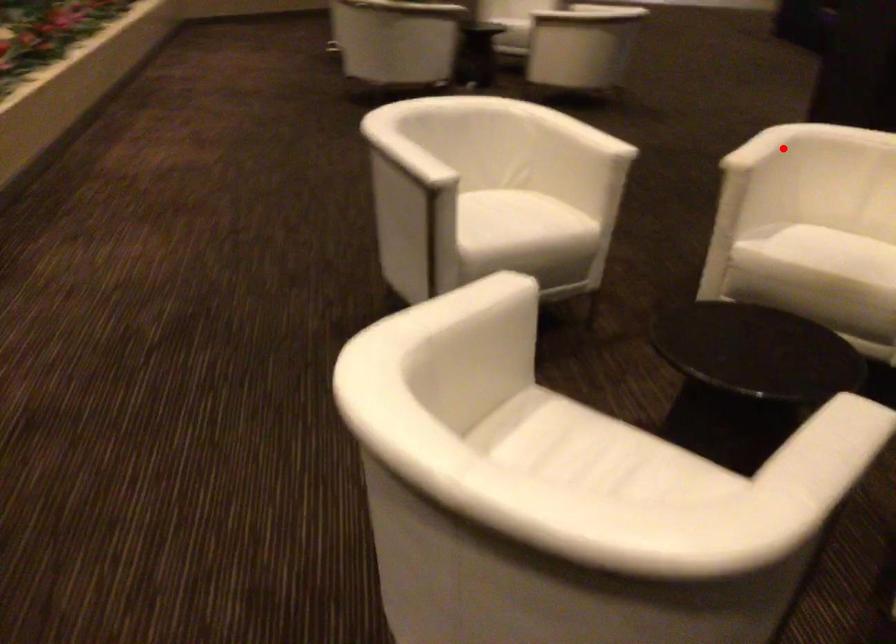
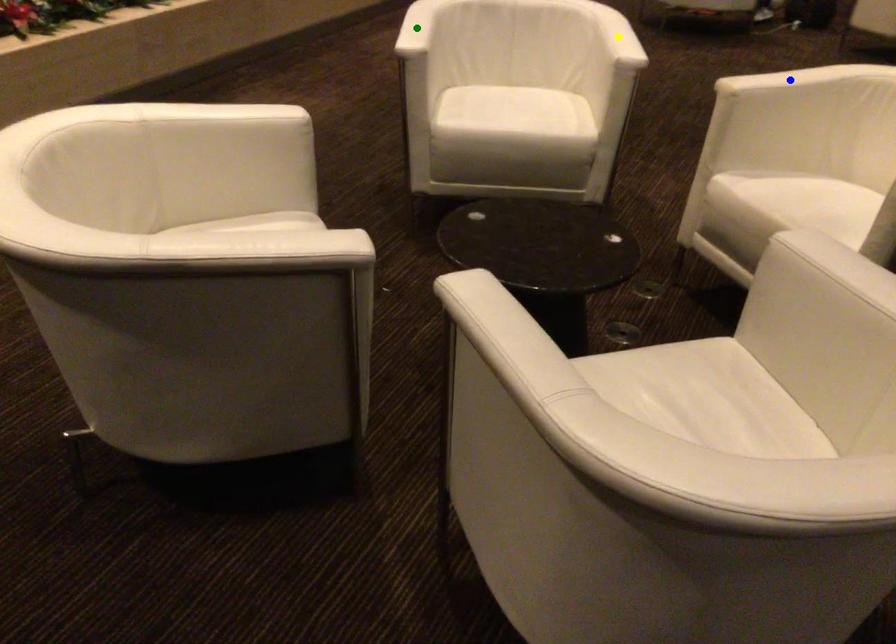
Question: I am providing you with two images of the same scene from different viewpoints. A red point is marked on the first image. You are given multiple points on the second image. Which point in image 2 represents the same 3d spot as the red point in image 1?

Choices:
 (A) blue point
 (B) green point
 (C) yellow point

Answer: (A)